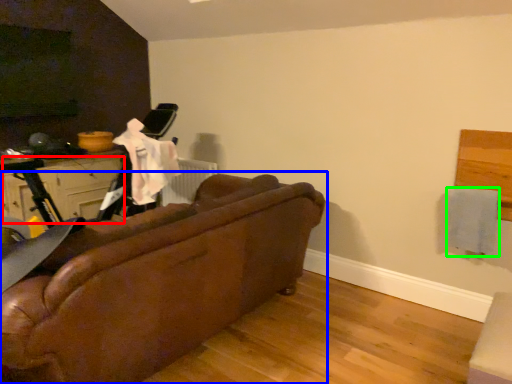
Question: Based on their relative distances, which object is farther from drawer (highlighted by a red box)? Choose from studio couch (highlighted by a blue box) and clothe (highlighted by a green box).

Choices:
 (A) studio couch
 (B) clothe

Answer: (B)